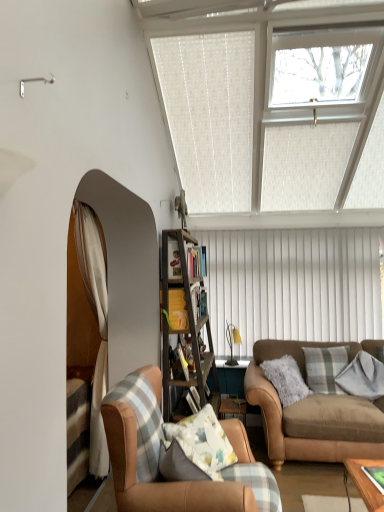
Question: From a real-world perspective, does leather armchair at lower left stand above gray flannel pillow at right, marked as the 2th pillow in a left-to-right arrangement?

Choices:
 (A) no
 (B) yes

Answer: (A)

Question: Is leather armchair at lower left thinner than gray flannel pillow at right, positioned as the 1th pillow in right-to-left order?

Choices:
 (A) no
 (B) yes

Answer: (A)

Question: Does leather armchair at lower left have a smaller size compared to gray flannel pillow at right, positioned as the 1th pillow in right-to-left order?

Choices:
 (A) yes
 (B) no

Answer: (B)

Question: Is leather armchair at lower left oriented towards gray flannel pillow at right, positioned as the 1th pillow in right-to-left order?

Choices:
 (A) yes
 (B) no

Answer: (B)

Question: From the image's perspective, is leather armchair at lower left under gray flannel pillow at right, positioned as the 1th pillow in right-to-left order?

Choices:
 (A) yes
 (B) no

Answer: (A)

Question: Is leather armchair at lower left oriented away from gray flannel pillow at right, positioned as the 1th pillow in right-to-left order?

Choices:
 (A) no
 (B) yes

Answer: (A)

Question: Considering the relative positions of yellow fabric at center, which is counted as the third shelf, starting from the back, and wooden bookshelf at center, the 1th shelf from the back, in the image provided, is yellow fabric at center, which is counted as the third shelf, starting from the back, to the right of wooden bookshelf at center, the 1th shelf from the back, from the viewer's perspective?

Choices:
 (A) no
 (B) yes

Answer: (A)

Question: Does yellow fabric at center, which is the first shelf from front to back, have a lesser height compared to wooden bookshelf at center, which is the third shelf from front to back?

Choices:
 (A) no
 (B) yes

Answer: (B)

Question: From the image's perspective, is yellow fabric at center, which is the first shelf from front to back, under wooden bookshelf at center, which is the third shelf from front to back?

Choices:
 (A) no
 (B) yes

Answer: (B)

Question: Is yellow fabric at center, which is the first shelf from front to back, oriented away from wooden bookshelf at center, the 1th shelf from the back?

Choices:
 (A) no
 (B) yes

Answer: (A)

Question: Is yellow fabric at center, which is counted as the third shelf, starting from the back, next to wooden bookshelf at center, the 1th shelf from the back, and touching it?

Choices:
 (A) no
 (B) yes

Answer: (A)

Question: Does yellow fabric at center, which is counted as the third shelf, starting from the back, lie in front of wooden bookshelf at center, the 1th shelf from the back?

Choices:
 (A) yes
 (B) no

Answer: (A)

Question: Does yellow fabric at center, which is the first shelf from front to back, have a lesser height compared to brown leather couch at lower right?

Choices:
 (A) no
 (B) yes

Answer: (B)